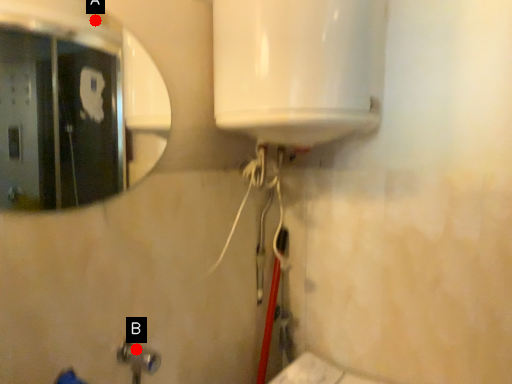
Question: Two points are circled on the image, labeled by A and B beside each circle. Which of the following is the farthest from the observer?

Choices:
 (A) A is further
 (B) B is further

Answer: (A)